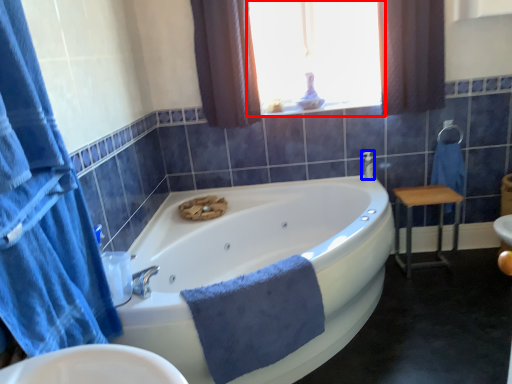
Question: Which point is closer to the camera, window (highlighted by a red box) or faucet (highlighted by a blue box)?

Choices:
 (A) window
 (B) faucet

Answer: (A)